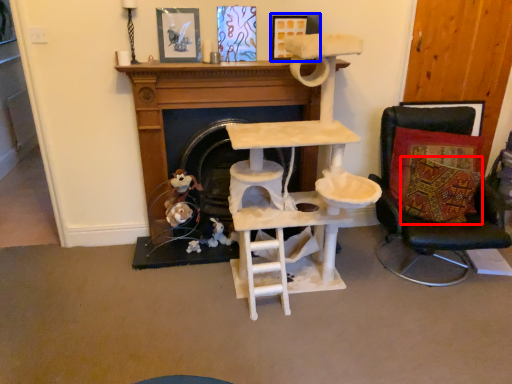
Question: Which object appears closest to the camera in this image, pillow (highlighted by a red box) or picture frame (highlighted by a blue box)?

Choices:
 (A) pillow
 (B) picture frame

Answer: (A)